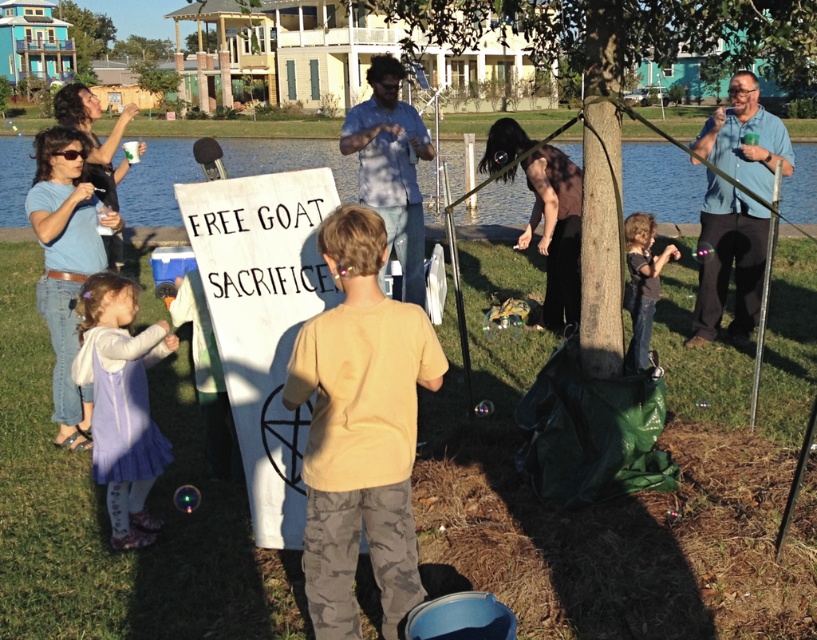
Question: Which point is farther from the camera taking this photo?

Choices:
 (A) pos(150,182)
 (B) pos(350,124)
 (C) pos(79,60)
 (D) pos(637,340)

Answer: (C)

Question: Which object is the closest to the brown bark tree at center?

Choices:
 (A) green leafy tree at upper center
 (B) dark brown denim jeans at lower right

Answer: (B)

Question: Can you confirm if light blue shirt at center is positioned to the left of dark brown denim jeans at lower right?

Choices:
 (A) yes
 (B) no

Answer: (A)

Question: Which point is farther from the camera taking this photo?

Choices:
 (A) (757, 216)
 (B) (636, 349)
 (C) (92, 314)
 (D) (364, 257)

Answer: (A)

Question: Is blue water at lake left bigger than light blue shirt at center?

Choices:
 (A) no
 (B) yes

Answer: (B)

Question: In this image, where is blue shirt at upper right located relative to light blue shirt at center?

Choices:
 (A) below
 (B) above

Answer: (B)